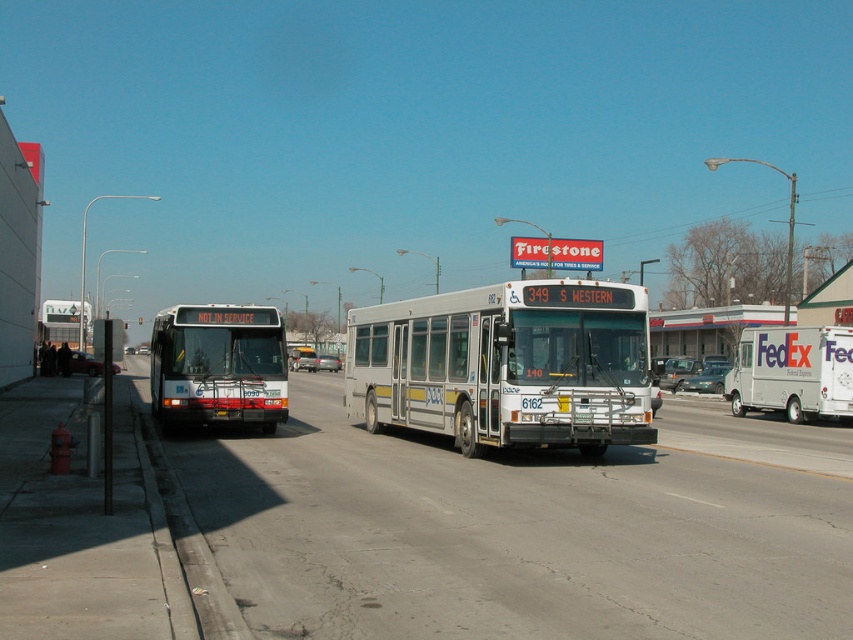
Is white metallic bus at center bigger than white matte bus at center?

Incorrect, white metallic bus at center is not larger than white matte bus at center.

Between point (383, 365) and point (181, 316), which one is positioned behind?

Point (383, 365)

Locate an element on the screen. This screenshot has height=640, width=853. white metallic bus at center is located at coordinates (506, 365).